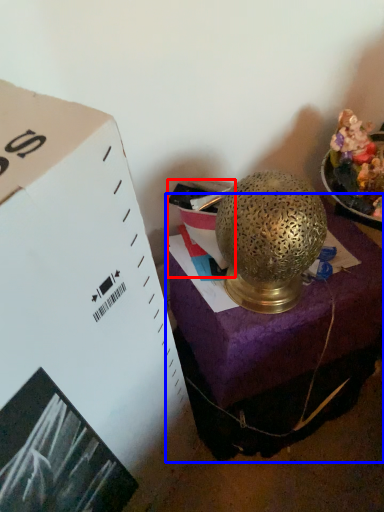
Question: Which object is closer to the camera taking this photo, box (highlighted by a red box) or furniture (highlighted by a blue box)?

Choices:
 (A) box
 (B) furniture

Answer: (B)